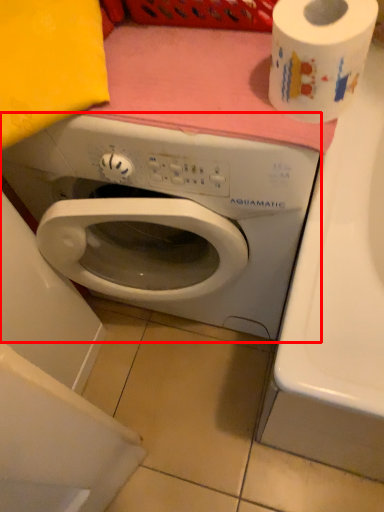
Question: From the image's perspective, where is washing machine (annotated by the red box) located in relation to toilet paper in the image?

Choices:
 (A) above
 (B) below

Answer: (B)